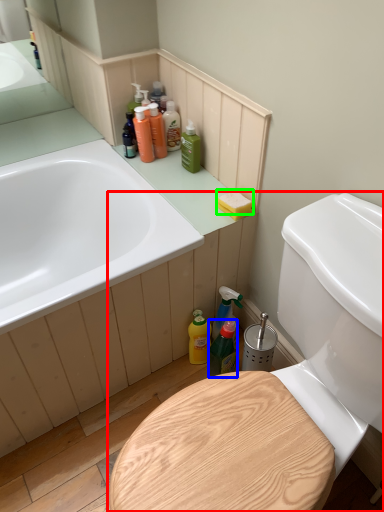
Question: Considering the real-world distances, which object is closest to toilet (highlighted by a red box)? bottle (highlighted by a blue box) or soap (highlighted by a green box).

Choices:
 (A) bottle
 (B) soap

Answer: (A)